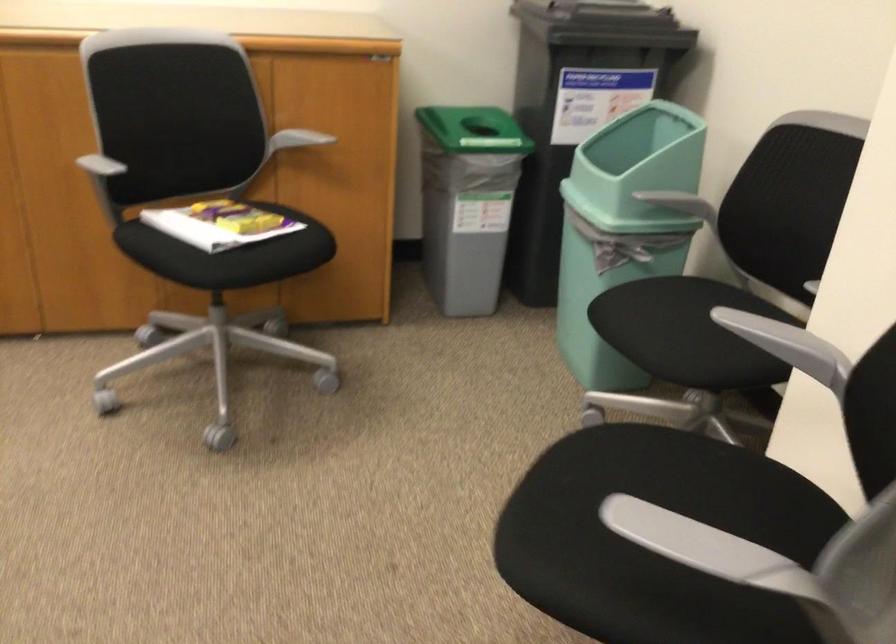
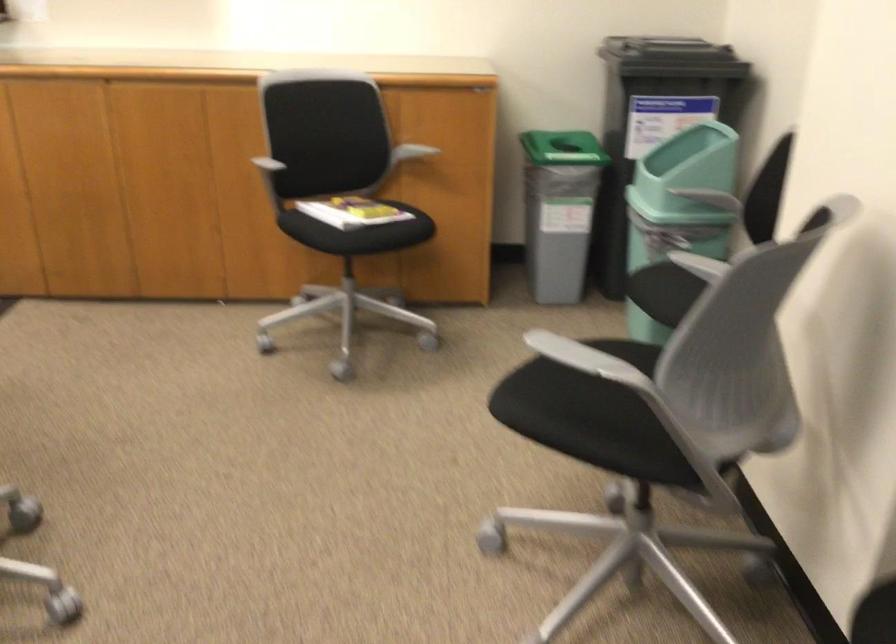
Find the pixel in the second image that matches point (640, 214) in the first image.

(678, 207)